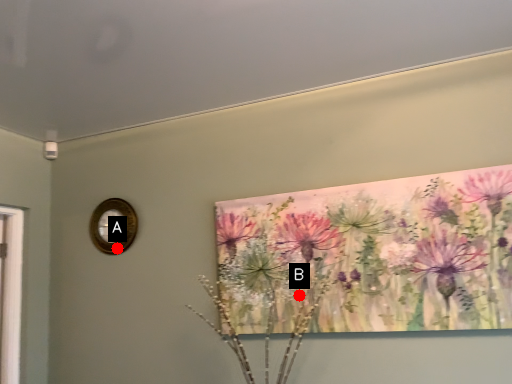
Question: Two points are circled on the image, labeled by A and B beside each circle. Which point is closer to the camera?

Choices:
 (A) A is closer
 (B) B is closer

Answer: (B)